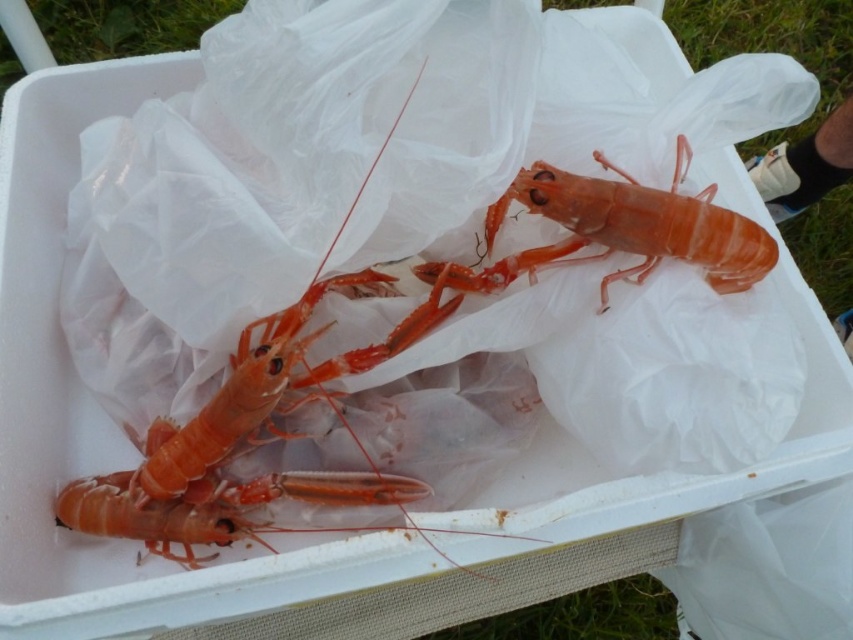
Question: Which point is farther from the camera taking this photo?

Choices:
 (A) (735, 250)
 (B) (215, 422)

Answer: (B)

Question: Which point is farther to the camera?

Choices:
 (A) (158, 502)
 (B) (607, 276)

Answer: (A)

Question: Is shiny orange lobster at center to the left of translucent orange lobster at center from the viewer's perspective?

Choices:
 (A) no
 (B) yes

Answer: (B)

Question: Does shiny orange lobster at center appear over translucent orange lobster at center?

Choices:
 (A) no
 (B) yes

Answer: (A)

Question: Does shiny orange lobster at center appear on the left side of translucent orange lobster at center?

Choices:
 (A) no
 (B) yes

Answer: (B)